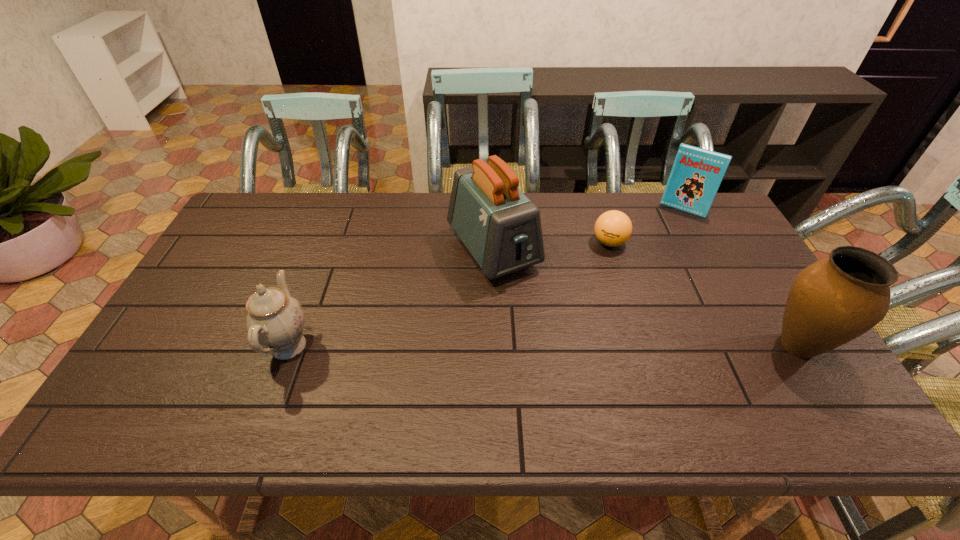
Find the location of a particular element. vacant space situated 0.120m on the side with brand of the third object from right to left is located at coordinates (576, 269).

The width and height of the screenshot is (960, 540). I want to click on free region located on the side with brand of the third object from right to left, so click(x=588, y=260).

Identify the location of blank area located 0.340m on the side with brand of the third object from right to left. (528, 309).

Image resolution: width=960 pixels, height=540 pixels. Find the location of `blank space located on the front-facing side of the second object from left to right`. blank space located on the front-facing side of the second object from left to right is located at coordinates (551, 330).

Identify the location of free space located 0.200m on the front-facing side of the second object from left to right. (555, 336).

This screenshot has height=540, width=960. I want to click on vacant position located 0.190m on the front-facing side of the second object from left to right, so click(x=553, y=333).

You are a GUI agent. You are given a task and a screenshot of the screen. Output one action in this format:
    pyautogui.click(x=<x>, y=<y>)
    Task: Click on the vacant space located 0.120m on the front cover of the book
    The width and height of the screenshot is (960, 540).
    Given the screenshot: What is the action you would take?
    pyautogui.click(x=666, y=236)

Where is `vacant region located 0.060m on the front cover of the book`? The image size is (960, 540). vacant region located 0.060m on the front cover of the book is located at coordinates (671, 226).

Locate an element on the screen. vacant space located 0.320m on the front cover of the book is located at coordinates (647, 273).

Where is `ping-pong ball positioned at the far edge`? This screenshot has height=540, width=960. ping-pong ball positioned at the far edge is located at coordinates (613, 228).